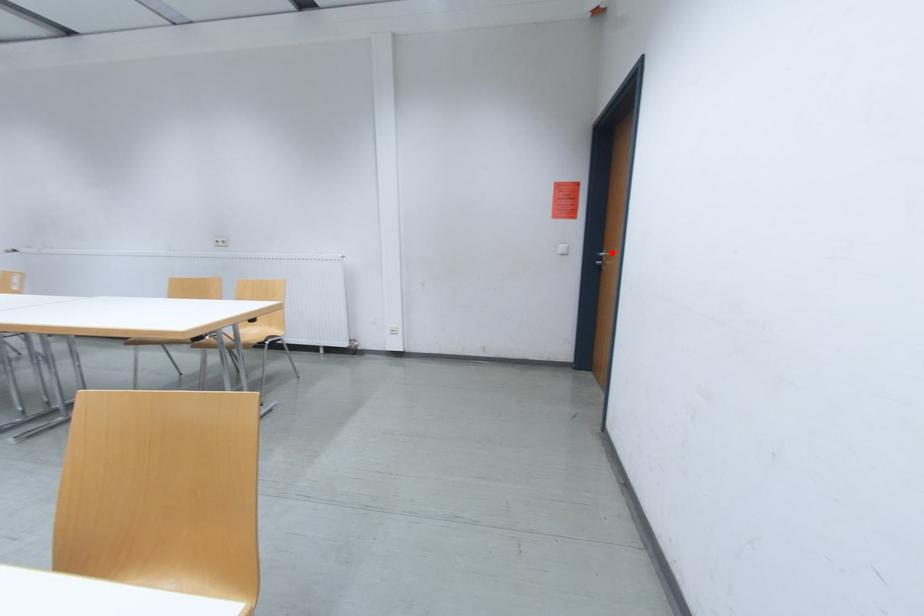
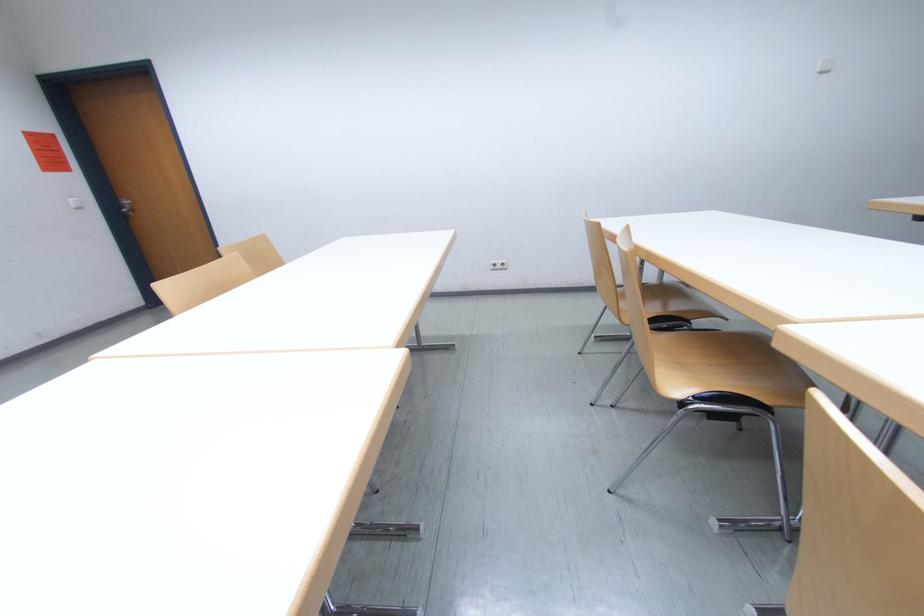
Where in the second image is the point corresponding to the highlighted location from the first image?

(128, 203)